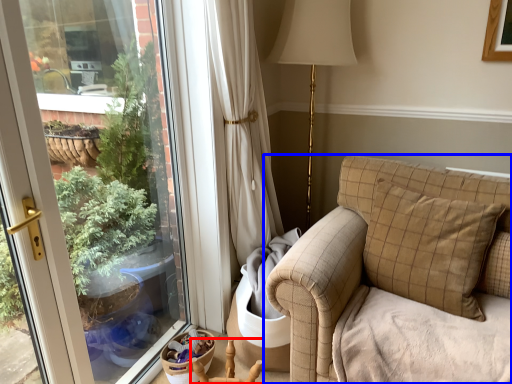
Question: Which object is further to the camera taking this photo, armchair (highlighted by a red box) or studio couch (highlighted by a blue box)?

Choices:
 (A) armchair
 (B) studio couch

Answer: (A)